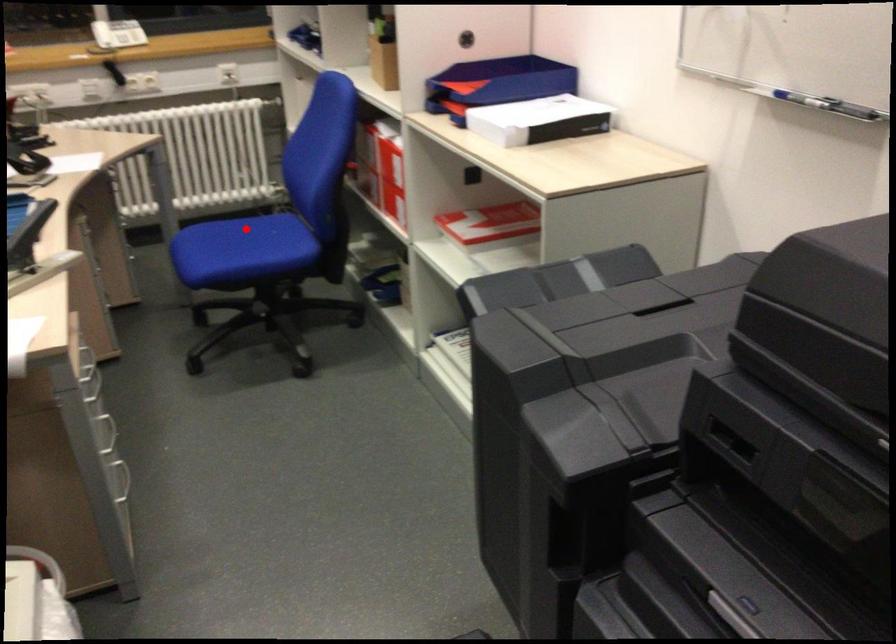
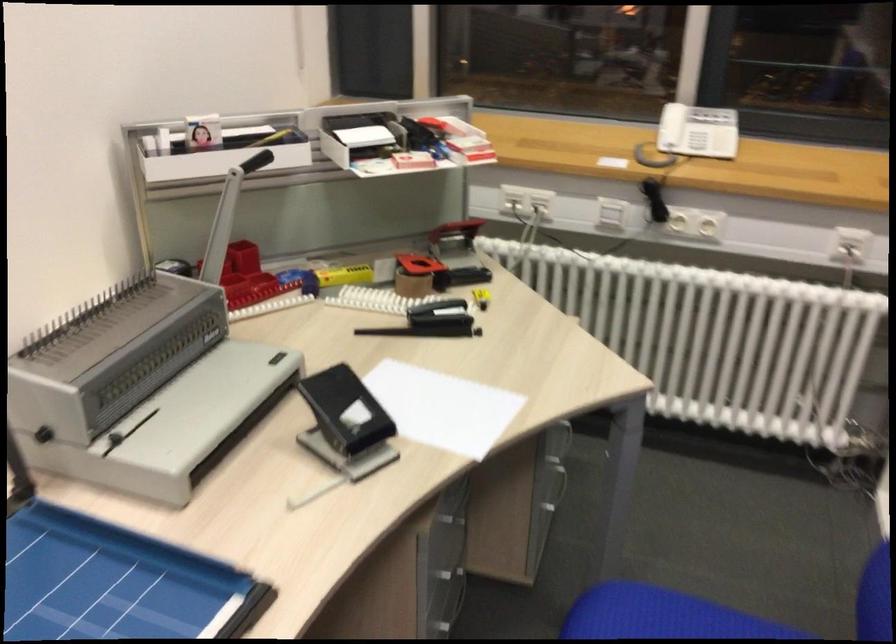
Where in the second image is the point corresponding to the highlighted location from the first image?

(713, 611)